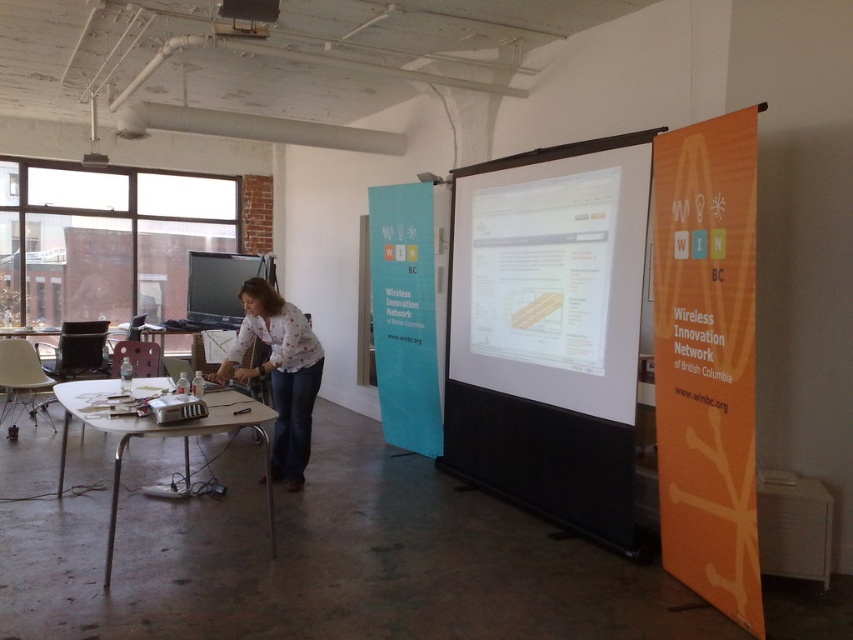
Question: Which point appears closest to the camera in this image?

Choices:
 (A) 589,396
 (B) 674,497
 (C) 396,221

Answer: (B)

Question: Which of the following is the closest to the observer?

Choices:
 (A) white printed shirt at center
 (B) white glossy table at lower left
 (C) orange paper at right
 (D) teal fabric banner at center

Answer: (C)

Question: Is orange paper at right below teal fabric banner at center?

Choices:
 (A) yes
 (B) no

Answer: (A)

Question: Does teal fabric banner at center appear on the right side of white printed shirt at center?

Choices:
 (A) yes
 (B) no

Answer: (A)

Question: Which of the following is the closest to the observer?

Choices:
 (A) tap(236, 326)
 (B) tap(477, 353)
 (C) tap(117, 486)

Answer: (C)

Question: Is teal fabric banner at center above white printed shirt at center?

Choices:
 (A) no
 (B) yes

Answer: (B)